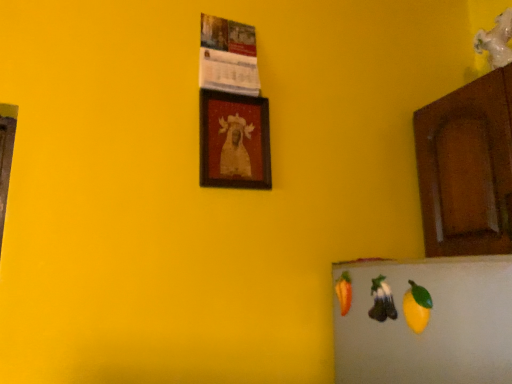
Find the location of a particular element. yellow matte fruit at lower right, which is counted as the first fruit, starting from the front is located at coordinates (417, 307).

The width and height of the screenshot is (512, 384). I want to click on wooden framed portrait at center, so click(x=234, y=141).

Identify the location of brown wood cabinet at right. The width and height of the screenshot is (512, 384). (467, 168).

Where is `yellow matte fruit at lower right, which is the second fruit in back-to-front order`? yellow matte fruit at lower right, which is the second fruit in back-to-front order is located at coordinates (417, 307).

Is wooden framed portrait at center positioned far away from shiny purple grapes at lower right, the second fruit from the front?

wooden framed portrait at center is near shiny purple grapes at lower right, the second fruit from the front, not far away.

Between wooden framed portrait at center and shiny purple grapes at lower right, which is the 1th fruit from back to front, which one has smaller size?

With smaller size is shiny purple grapes at lower right, which is the 1th fruit from back to front.

From the picture: From the image's perspective, is wooden framed portrait at center above shiny purple grapes at lower right, the second fruit from the front?

Yes, from the image's perspective, wooden framed portrait at center is over shiny purple grapes at lower right, the second fruit from the front.

Considering the points (410, 286) and (393, 307), which point is in front, point (410, 286) or point (393, 307)?

The point (410, 286) is closer.

In terms of size, does yellow matte fruit at lower right, which is counted as the first fruit, starting from the front, appear bigger or smaller than shiny purple grapes at lower right, which is the 1th fruit from back to front?

In the image, yellow matte fruit at lower right, which is counted as the first fruit, starting from the front, appears to be smaller than shiny purple grapes at lower right, which is the 1th fruit from back to front.

Measure the distance between yellow matte fruit at lower right, which is the second fruit in back-to-front order, and shiny purple grapes at lower right, which is the 1th fruit from back to front.

yellow matte fruit at lower right, which is the second fruit in back-to-front order, is 2.71 inches away from shiny purple grapes at lower right, which is the 1th fruit from back to front.

Would you say yellow matte fruit at lower right, which is the second fruit in back-to-front order, is inside or outside shiny purple grapes at lower right, which is the 1th fruit from back to front?

yellow matte fruit at lower right, which is the second fruit in back-to-front order, lies outside shiny purple grapes at lower right, which is the 1th fruit from back to front.

Looking at this image, from the image's perspective, is brown wood cabinet at right below wooden framed portrait at center?

Yes, from the image's perspective, brown wood cabinet at right is below wooden framed portrait at center.

Is point (473, 216) positioned before point (209, 149)?

No, it is not.

What's the angular difference between brown wood cabinet at right and wooden framed portrait at center's facing directions?

brown wood cabinet at right and wooden framed portrait at center are facing 90 degrees away from each other.

Looking at the image, does brown wood cabinet at right seem bigger or smaller compared to wooden framed portrait at center?

In the image, brown wood cabinet at right appears to be larger than wooden framed portrait at center.

Find the location of a particular element. This screenshot has height=384, width=512. cabinetry that is above the yellow matte fruit at lower right, which is the second fruit in back-to-front order (from a real-world perspective) is located at coordinates (467, 168).

From the image's perspective, which is below, yellow matte fruit at lower right, which is the second fruit in back-to-front order, or brown wood cabinet at right?

yellow matte fruit at lower right, which is the second fruit in back-to-front order, from the image's perspective.

Considering the points (409, 284) and (497, 110), which point is behind, point (409, 284) or point (497, 110)?

Point (497, 110)

Is yellow matte fruit at lower right, which is counted as the first fruit, starting from the front, positioned with its back to brown wood cabinet at right?

yellow matte fruit at lower right, which is counted as the first fruit, starting from the front, is not turned away from brown wood cabinet at right.

Is wooden framed portrait at center facing away from yellow matte fruit at lower right, which is counted as the first fruit, starting from the front?

wooden framed portrait at center is not turned away from yellow matte fruit at lower right, which is counted as the first fruit, starting from the front.

Is wooden framed portrait at center positioned in front of yellow matte fruit at lower right, which is the second fruit in back-to-front order?

That is False.

From the image's perspective, count 1st fruits downward from the wooden framed portrait at center and point to it. Please provide its 2D coordinates.

[(417, 307)]

From a real-world perspective, who is located higher, wooden framed portrait at center or yellow matte fruit at lower right, which is the second fruit in back-to-front order?

In real-world perspective, wooden framed portrait at center is above.

Is shiny purple grapes at lower right, which is the 1th fruit from back to front, closer to camera compared to yellow matte fruit at lower right, which is the second fruit in back-to-front order?

No, shiny purple grapes at lower right, which is the 1th fruit from back to front, is further to the viewer.

Does shiny purple grapes at lower right, which is the 1th fruit from back to front, have a larger size compared to yellow matte fruit at lower right, which is counted as the first fruit, starting from the front?

Yes.

Is point (372, 318) positioned behind point (423, 296)?

Yes, point (372, 318) is behind point (423, 296).

Does shiny purple grapes at lower right, the second fruit from the front, have a lesser height compared to yellow matte fruit at lower right, which is the second fruit in back-to-front order?

Yes, shiny purple grapes at lower right, the second fruit from the front, is shorter than yellow matte fruit at lower right, which is the second fruit in back-to-front order.

How many degrees apart are the facing directions of wooden framed portrait at center and brown wood cabinet at right?

90 degrees separate the facing orientations of wooden framed portrait at center and brown wood cabinet at right.

Does wooden framed portrait at center have a greater width compared to brown wood cabinet at right?

In fact, wooden framed portrait at center might be narrower than brown wood cabinet at right.

Is wooden framed portrait at center positioned behind brown wood cabinet at right?

That is True.

Can you see wooden framed portrait at center touching brown wood cabinet at right?

No, wooden framed portrait at center is not with brown wood cabinet at right.

Locate an element on the screen. This screenshot has width=512, height=384. fruit that is the 1st one below the wooden framed portrait at center (from a real-world perspective) is located at coordinates (382, 301).

This screenshot has width=512, height=384. I want to click on fruit in front of the shiny purple grapes at lower right, which is the 1th fruit from back to front, so click(x=417, y=307).

Looking at this image, based on their spatial positions, is brown wood cabinet at right or yellow matte fruit at lower right, which is counted as the first fruit, starting from the front, closer to shiny purple grapes at lower right, which is the 1th fruit from back to front?

yellow matte fruit at lower right, which is counted as the first fruit, starting from the front, is positioned closer to the anchor shiny purple grapes at lower right, which is the 1th fruit from back to front.

From the image, which object appears to be farther from wooden framed portrait at center, shiny purple grapes at lower right, the second fruit from the front, or yellow matte fruit at lower right, which is the second fruit in back-to-front order?

Among the two, yellow matte fruit at lower right, which is the second fruit in back-to-front order, is located further to wooden framed portrait at center.

Based on their spatial positions, is wooden framed portrait at center or brown wood cabinet at right closer to shiny purple grapes at lower right, which is the 1th fruit from back to front?

brown wood cabinet at right.

Estimate the real-world distances between objects in this image. Which object is closer to wooden framed portrait at center, yellow matte fruit at lower right, which is the second fruit in back-to-front order, or brown wood cabinet at right?

Among the two, brown wood cabinet at right is located nearer to wooden framed portrait at center.

Based on the photo, when comparing their distances from yellow matte fruit at lower right, which is the second fruit in back-to-front order, does shiny purple grapes at lower right, which is the 1th fruit from back to front, or wooden framed portrait at center seem closer?

Based on the image, shiny purple grapes at lower right, which is the 1th fruit from back to front, appears to be nearer to yellow matte fruit at lower right, which is the second fruit in back-to-front order.

From the image, which object appears to be nearer to wooden framed portrait at center, brown wood cabinet at right or yellow matte fruit at lower right, which is counted as the first fruit, starting from the front?

brown wood cabinet at right is positioned closer to the anchor wooden framed portrait at center.

When comparing their distances from shiny purple grapes at lower right, which is the 1th fruit from back to front, does brown wood cabinet at right or wooden framed portrait at center seem further?

wooden framed portrait at center lies further to shiny purple grapes at lower right, which is the 1th fruit from back to front, than the other object.

Estimate the real-world distances between objects in this image. Which object is further from shiny purple grapes at lower right, which is the 1th fruit from back to front, yellow matte fruit at lower right, which is the second fruit in back-to-front order, or wooden framed portrait at center?

wooden framed portrait at center.

Locate an element on the screen. This screenshot has width=512, height=384. fruit between shiny purple grapes at lower right, which is the 1th fruit from back to front, and brown wood cabinet at right, in the horizontal direction is located at coordinates (417, 307).

You are a GUI agent. You are given a task and a screenshot of the screen. Output one action in this format:
    pyautogui.click(x=<x>, y=<y>)
    Task: Click on the fruit between wooden framed portrait at center and shiny purple grapes at lower right, which is the 1th fruit from back to front, from top to bottom
    
    Given the screenshot: What is the action you would take?
    point(417,307)